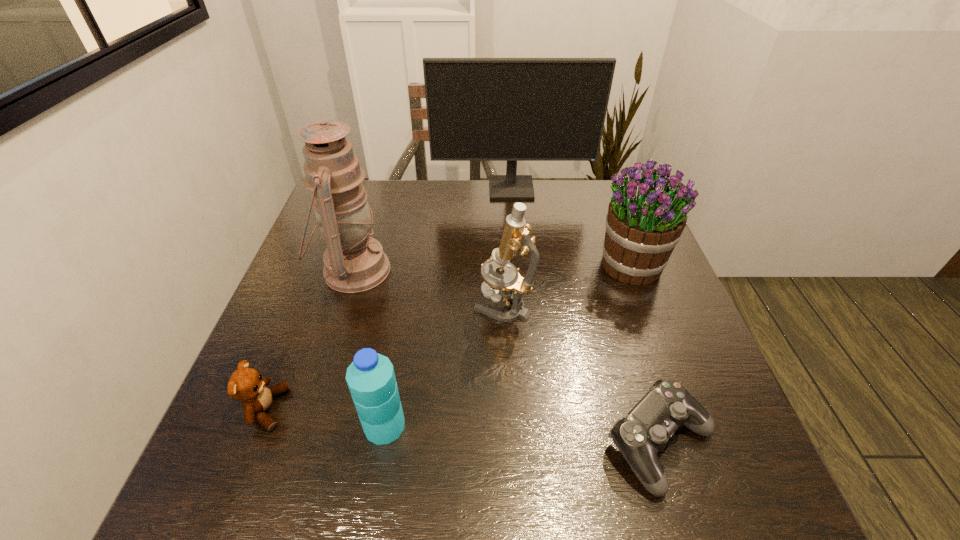
Find the location of a particular element. The height and width of the screenshot is (540, 960). control located in the right edge section of the desktop is located at coordinates (645, 430).

Identify the location of object that is at the far right corner. The height and width of the screenshot is (540, 960). (478, 109).

Identify the location of object located in the near right corner section of the desktop. point(645,430).

The image size is (960, 540). Find the location of `vacant space at the far edge`. vacant space at the far edge is located at coordinates (383, 187).

Identify the location of free space at the near edge. (343, 483).

Find the location of a particular element. The image size is (960, 540). free space at the left edge is located at coordinates (291, 289).

Locate an element on the screen. This screenshot has height=540, width=960. vacant position at the right edge of the desktop is located at coordinates (619, 315).

Identify the location of vacant space at the far left corner. This screenshot has width=960, height=540. (378, 187).

This screenshot has width=960, height=540. In the image, there is a desktop. What are the coordinates of `blank space at the near left corner` in the screenshot? It's located at (281, 464).

You are a GUI agent. You are given a task and a screenshot of the screen. Output one action in this format:
    pyautogui.click(x=<x>, y=<y>)
    Task: Click on the free region at the far right corner of the desktop
    Image resolution: width=960 pixels, height=540 pixels.
    Given the screenshot: What is the action you would take?
    pyautogui.click(x=600, y=191)